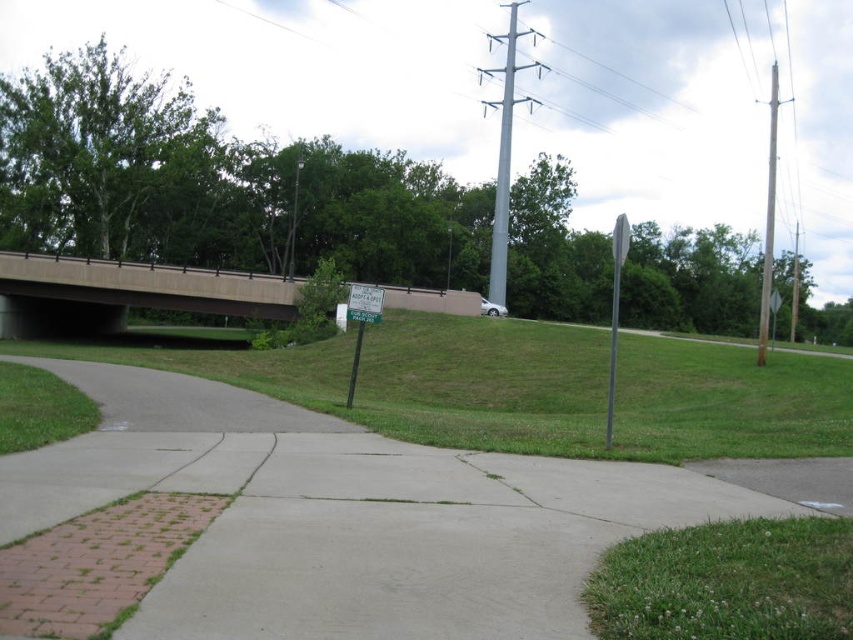
You are a gardener who needs to mow the lawn. You see the green grassy at lower center and the concrete bridge at upper center. Which area requires mowing?

The green grassy at lower center requires mowing because it is shorter than the concrete bridge at upper center, indicating it is grass that needs maintenance.

You are a pedestrian walking along the paved pathway and want to reach the bridge. You see the concrete bridge at upper center and the metallic gray sign at right. Which object should you head toward first to reach the bridge?

You should head toward the concrete bridge at upper center first because it is located to the left of the metallic gray sign at right, meaning it is closer to your current position on the pathway.